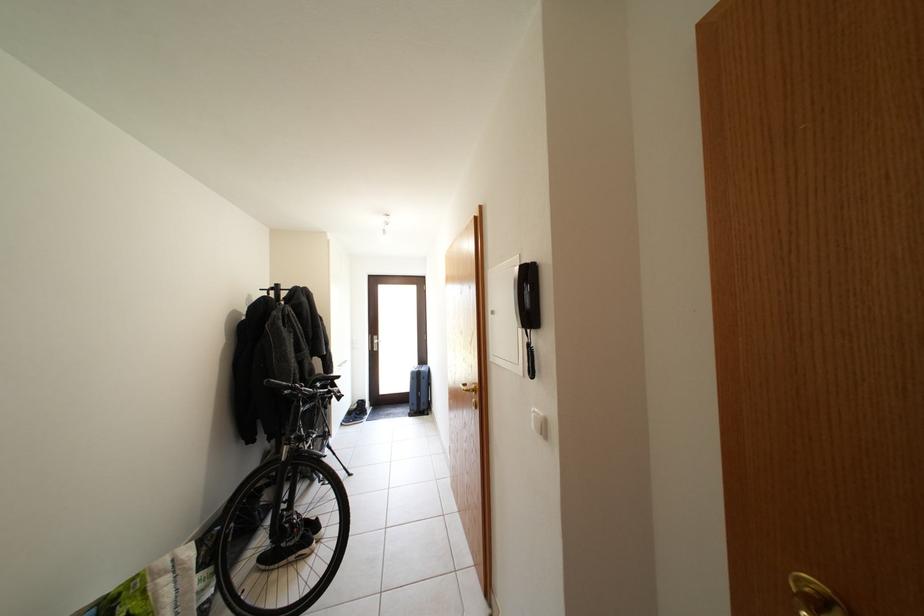
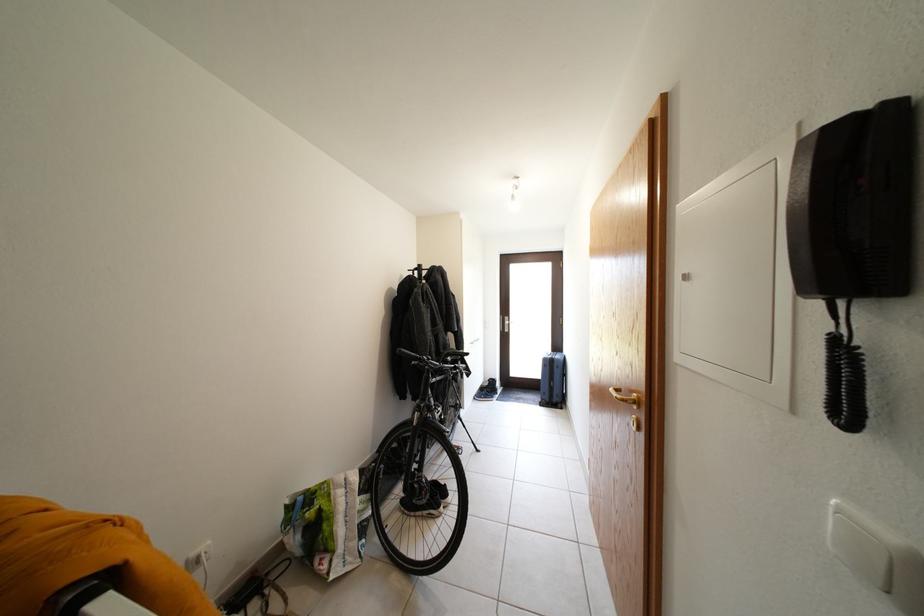
Question: The first image is from the beginning of the video and the second image is from the end. How did the camera likely rotate when shooting the video?

Choices:
 (A) Left
 (B) Right
 (C) Up
 (D) Down

Answer: (A)